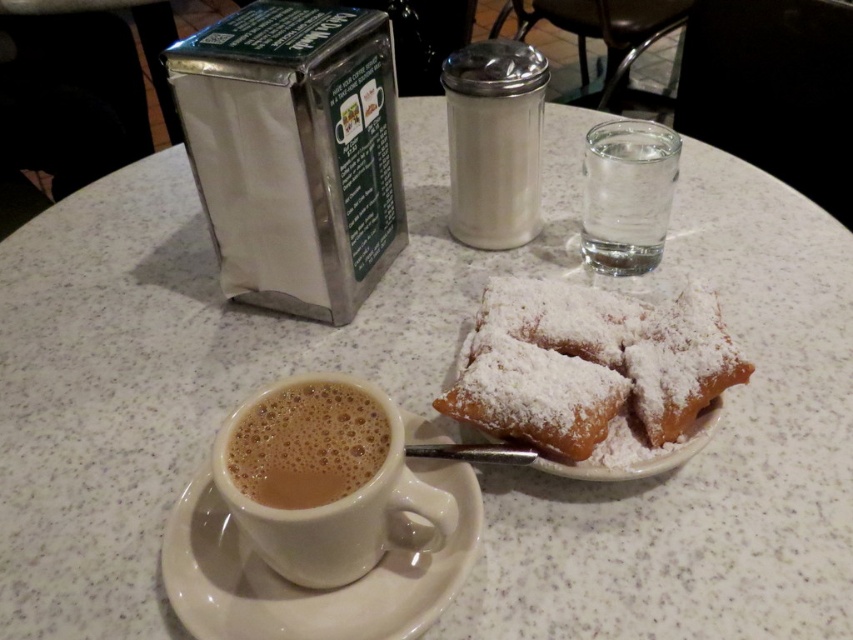
Between point (241, 600) and point (514, 193), which one is positioned behind?

The point (514, 193) is more distant.

Find the location of a particular element. The width and height of the screenshot is (853, 640). white glossy saucer at lower left is located at coordinates (321, 589).

Who is shorter, white glossy saucer at lower left or brown frothy coffee at lower left?

With less height is brown frothy coffee at lower left.

Is point (256, 595) farther from camera compared to point (318, 486)?

Yes, point (256, 595) is behind point (318, 486).

Identify the location of white glossy saucer at lower left. 321,589.

Between powdery golden pastry at center and clear glass water at upper right, which one is positioned lower?

powdery golden pastry at center is below.

Is point (698, 316) closer to viewer compared to point (665, 192)?

Yes, it is.

Between point (485, 291) and point (637, 212), which one is positioned in front?

Positioned in front is point (485, 291).

Identify the location of powdery golden pastry at center. (589, 364).